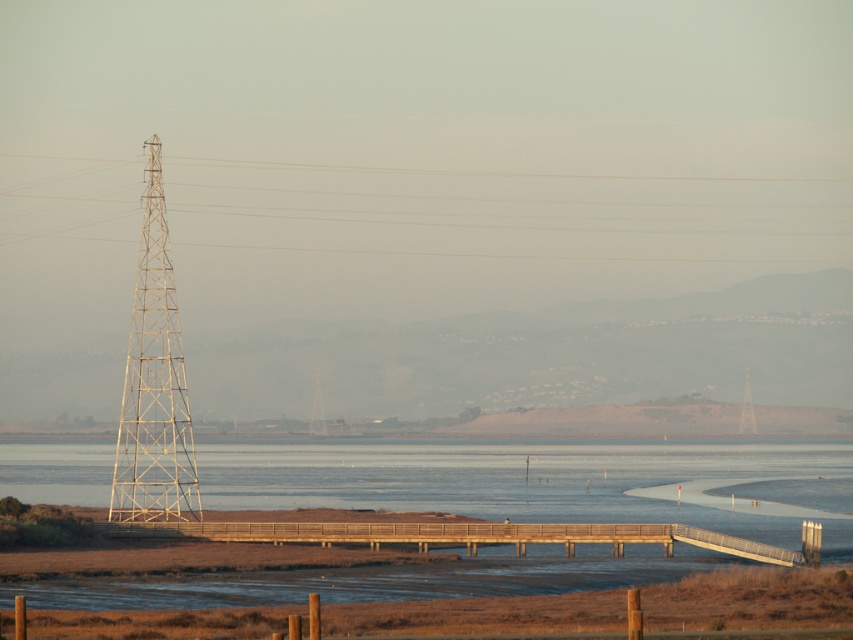
Is point (316, 452) positioned after point (746, 412)?

No, (316, 452) is in front of (746, 412).

Is clear water at center closer to camera compared to metallic tower at right?

Yes, it is.

I want to click on clear water at center, so click(x=550, y=483).

Can you confirm if metallic silver tower at left is smaller than metallic tower at right?

Actually, metallic silver tower at left might be larger than metallic tower at right.

Which of these two, metallic silver tower at left or metallic tower at right, stands shorter?

With less height is metallic tower at right.

Does point (451, 253) lie behind point (750, 426)?

Yes, it is.

Where is `metallic silver tower at left`? The image size is (853, 640). metallic silver tower at left is located at coordinates (512, 253).

Between metallic lattice tower at left and metallic tower at right, which one is positioned lower?

metallic tower at right is lower down.

Based on the photo, which is more to the left, metallic lattice tower at left or metallic tower at right?

From the viewer's perspective, metallic lattice tower at left appears more on the left side.

Does point (155, 444) come in front of point (753, 419)?

Yes, point (155, 444) is in front of point (753, 419).

Where is `metallic lattice tower at left`? The height and width of the screenshot is (640, 853). metallic lattice tower at left is located at coordinates (154, 384).